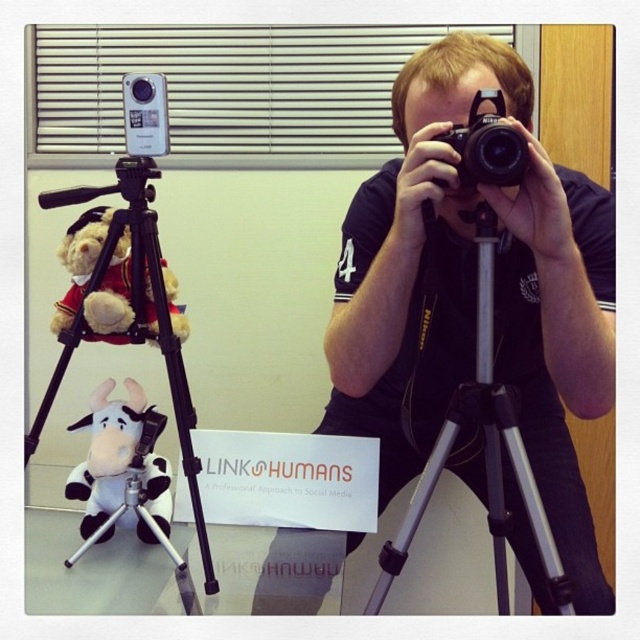
You are a photographer setting up equipment in an office. You have a velvet teddy bear at left and a black plastic camera at center. Which object is positioned more to the left side of the frame?

The velvet teddy bear at left is positioned more to the left side of the frame compared to the black plastic camera at center.

You are a photographer setting up equipment for a photoshoot. You have a silver metallic tripod at lower left and a velvet teddy bear at left. Which object is taller?

The silver metallic tripod at lower left is taller than the velvet teddy bear at left according to the description.

Where is the silver metallic tripod at center located in the image?

The silver metallic tripod at center is located at point (483,451) in the image.